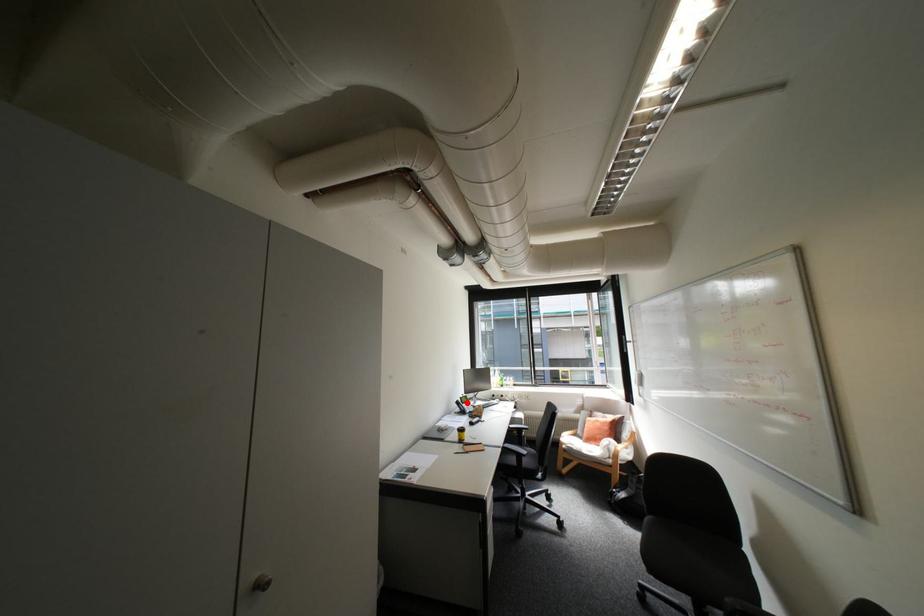
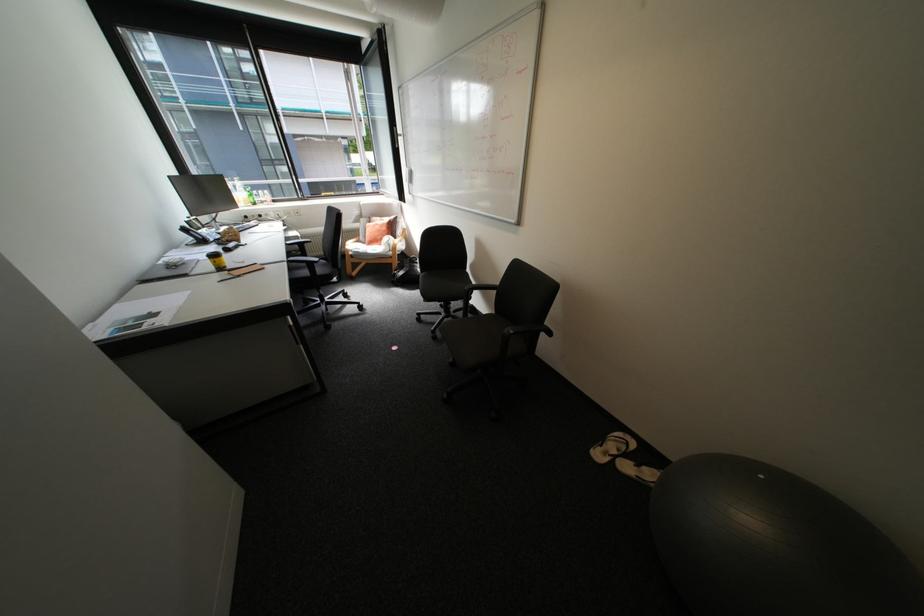
Question: A red point is marked in image1. In image2, is the corresponding 3D point closer to the camera or farther? Reply with the corresponding letter.

Choices:
 (A) The corresponding 3D point is closer.
 (B) The corresponding 3D point is farther.

Answer: (A)